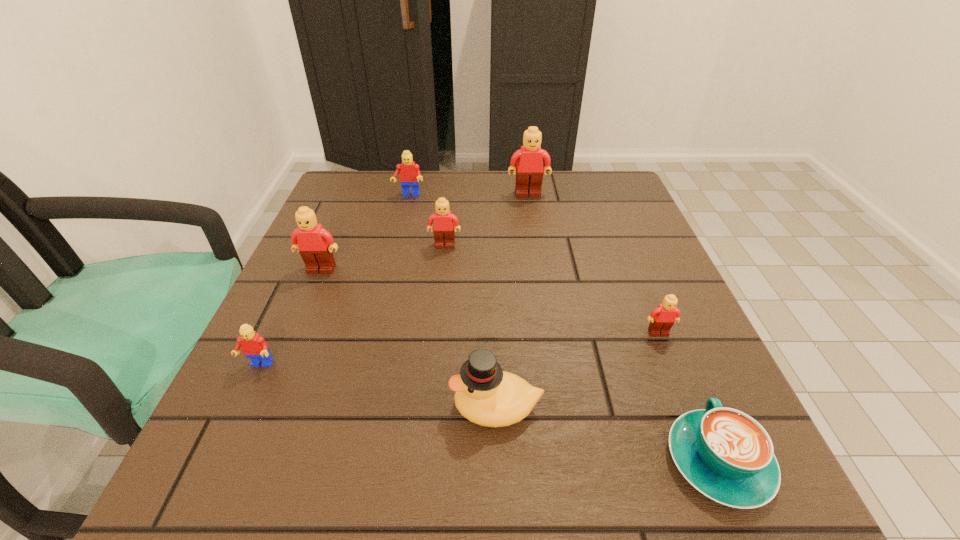
You are a GUI agent. You are given a task and a screenshot of the screen. Output one action in this format:
    pyautogui.click(x=<x>, y=<y>)
    Task: Click on the rightmost brown Lego
    
    Given the screenshot: What is the action you would take?
    pyautogui.click(x=663, y=317)

Identify the location of the smaller red Lego. (253, 345).

At what (x,y) coordinates should I click in order to perform the action: click on the nearest Lego. Please return your answer as a coordinate pair (x, y). This screenshot has height=540, width=960. Looking at the image, I should click on (253, 345).

The image size is (960, 540). Find the location of `cappuccino`. cappuccino is located at coordinates point(725,454).

The image size is (960, 540). Identify the location of the shortest object. (725, 454).

The width and height of the screenshot is (960, 540). Find the location of `free space located 0.240m on the face of the biggest brown Lego`. free space located 0.240m on the face of the biggest brown Lego is located at coordinates (538, 256).

Locate an element on the screen. The width and height of the screenshot is (960, 540). vacant space located 0.400m on the face of the seventh shortest object is located at coordinates (240, 463).

You are a GUI agent. You are given a task and a screenshot of the screen. Output one action in this format:
    pyautogui.click(x=<x>, y=<y>)
    Task: Click on the vacant space situated on the front-facing side of the bigger red Lego
    This screenshot has width=960, height=540.
    Given the screenshot: What is the action you would take?
    [387, 288]

Find the location of a particular element. This screenshot has width=960, height=540. free region located on the face of the second smallest brown Lego is located at coordinates (433, 361).

Identify the location of free region located on the front-facing side of the duck. The width and height of the screenshot is (960, 540). (392, 407).